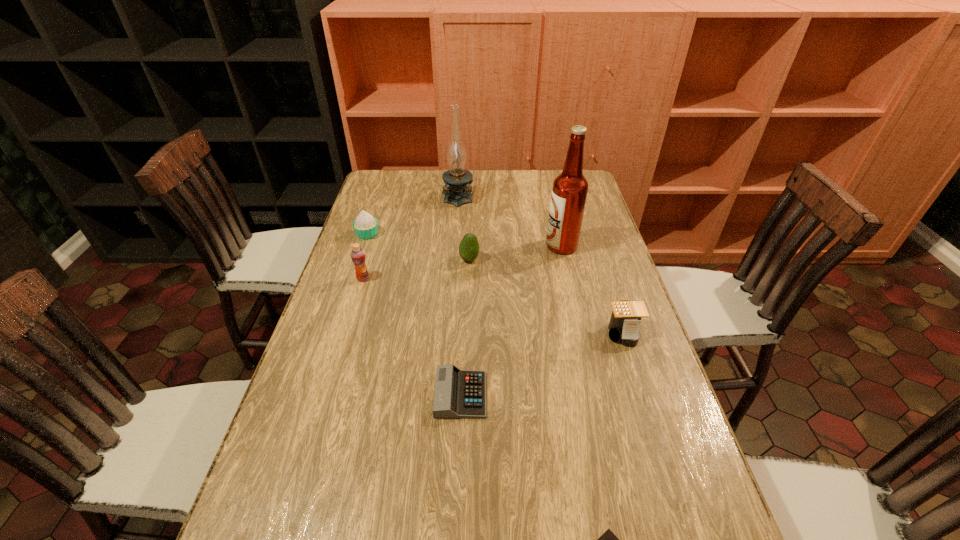
The width and height of the screenshot is (960, 540). Identify the location of free spot between the leftmost calculator and the avocado. pyautogui.click(x=465, y=327).

I want to click on empty space that is in between the cupcake and the avocado, so click(419, 247).

Where is `vacant space that is in between the fifth farthest object and the avocado`? This screenshot has width=960, height=540. vacant space that is in between the fifth farthest object and the avocado is located at coordinates (417, 269).

You are a GUI agent. You are given a task and a screenshot of the screen. Output one action in this format:
    pyautogui.click(x=<x>, y=<y>)
    Task: Click on the free point between the avocado and the third tallest object
    The image size is (960, 540).
    Given the screenshot: What is the action you would take?
    pyautogui.click(x=417, y=269)

Locate an element on the screen. vacant area between the second tallest calculator and the oil lamp is located at coordinates click(x=460, y=295).

You are a GUI agent. You are given a task and a screenshot of the screen. Output one action in this format:
    pyautogui.click(x=<x>, y=<y>)
    Task: Click on the vacant space in between the avocado and the alcohol
    
    Given the screenshot: What is the action you would take?
    pyautogui.click(x=516, y=253)

The width and height of the screenshot is (960, 540). I want to click on object that is the closest to the avocado, so click(569, 192).

Find the location of a particular element. The height and width of the screenshot is (540, 960). object that ranks as the third closest to the nearest calculator is located at coordinates (469, 247).

Locate which calculator ranks in proximity to the cupcake. Please provide its 2D coordinates. Your answer should be formatted as a tuple, i.e. [(x, y)], where the tuple contains the x and y coordinates of a point satisfying the conditions above.

[(458, 393)]

You are a GUI agent. You are given a task and a screenshot of the screen. Output one action in this format:
    pyautogui.click(x=<x>, y=<y>)
    Task: Click on the calculator that is the second nearest to the avocado
    This screenshot has width=960, height=540.
    Given the screenshot: What is the action you would take?
    pyautogui.click(x=624, y=324)